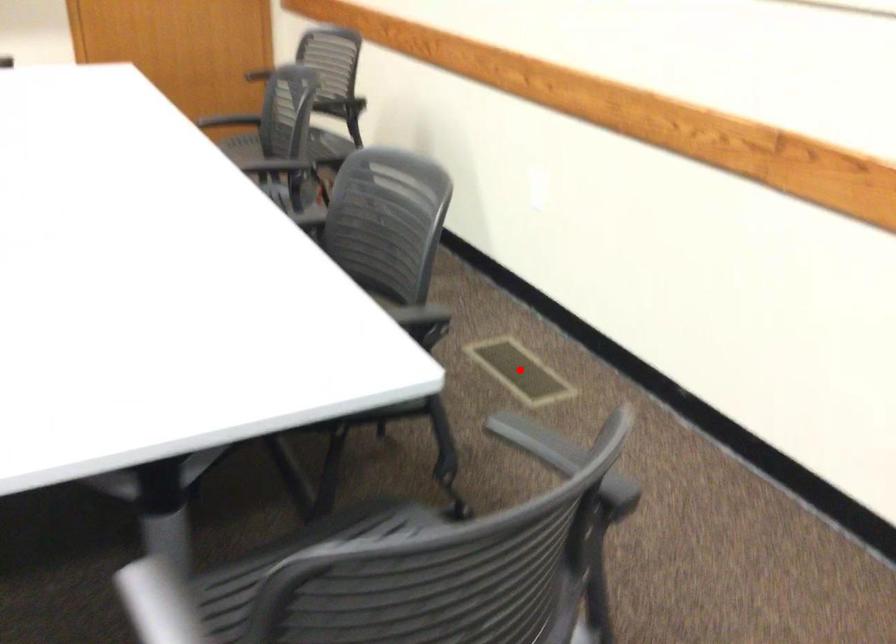
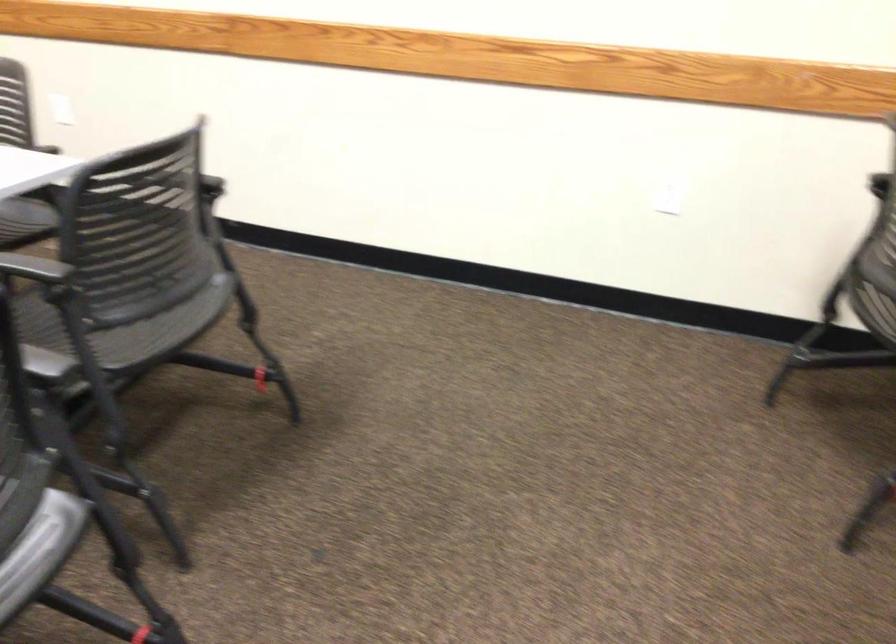
Question: I am providing you with two images of the same scene from different viewpoints. A red point is marked on the first image. At the location where the point appears in image 1, is it still visible in image 2?

Choices:
 (A) Yes
 (B) No

Answer: (B)